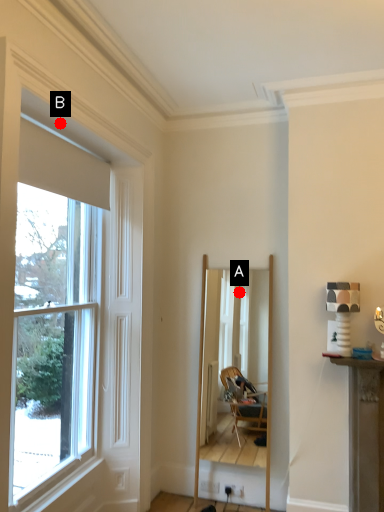
Question: Two points are circled on the image, labeled by A and B beside each circle. Among these points, which one is farthest from the camera?

Choices:
 (A) A is further
 (B) B is further

Answer: (A)